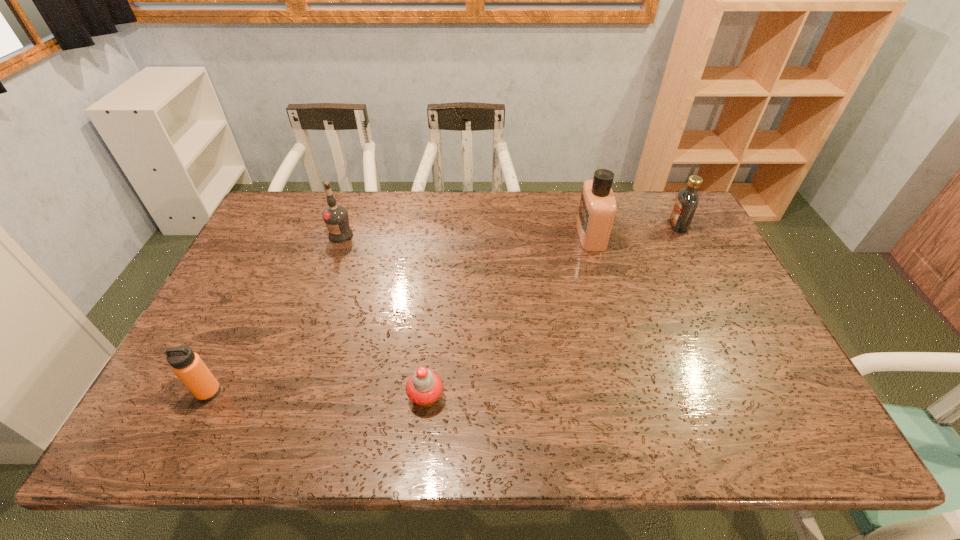
This screenshot has height=540, width=960. Identify the location of perfume. (597, 208).

Where is `the left vodka`? The width and height of the screenshot is (960, 540). the left vodka is located at coordinates (336, 218).

This screenshot has height=540, width=960. What are the coordinates of `the rightmost object` in the screenshot? It's located at (687, 201).

Find the location of a particular element. The width and height of the screenshot is (960, 540). the leftmost object is located at coordinates (187, 365).

I want to click on the third object from right to left, so click(x=424, y=387).

Where is `cupcake`? The height and width of the screenshot is (540, 960). cupcake is located at coordinates tap(424, 387).

In order to click on free space located 0.250m on the front label of the second object from right to left in this screenshot , I will do `click(501, 235)`.

Find the location of a particular element. The height and width of the screenshot is (540, 960). blank space located 0.290m on the front label of the second object from right to left is located at coordinates (490, 235).

You are a GUI agent. You are given a task and a screenshot of the screen. Output one action in this format:
    pyautogui.click(x=<x>, y=<y>)
    Task: Click on the vacant space situated 0.180m on the front label of the second object from right to left
    
    Given the screenshot: What is the action you would take?
    pyautogui.click(x=523, y=235)

Where is `vacant space located 0.140m on the front label of the left vodka`? The image size is (960, 540). vacant space located 0.140m on the front label of the left vodka is located at coordinates (327, 274).